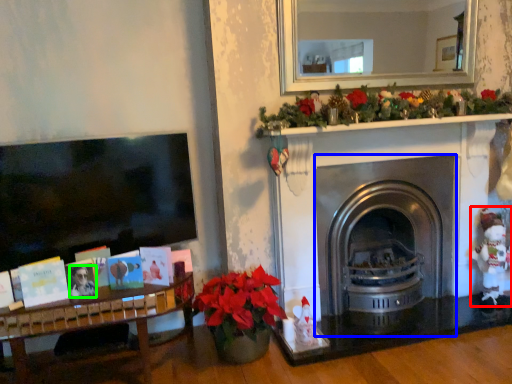
Question: Based on their relative distances, which object is nearer to toy (highlighted by a red box)? Choose from fireplace (highlighted by a blue box) and person (highlighted by a green box).

Choices:
 (A) fireplace
 (B) person

Answer: (A)